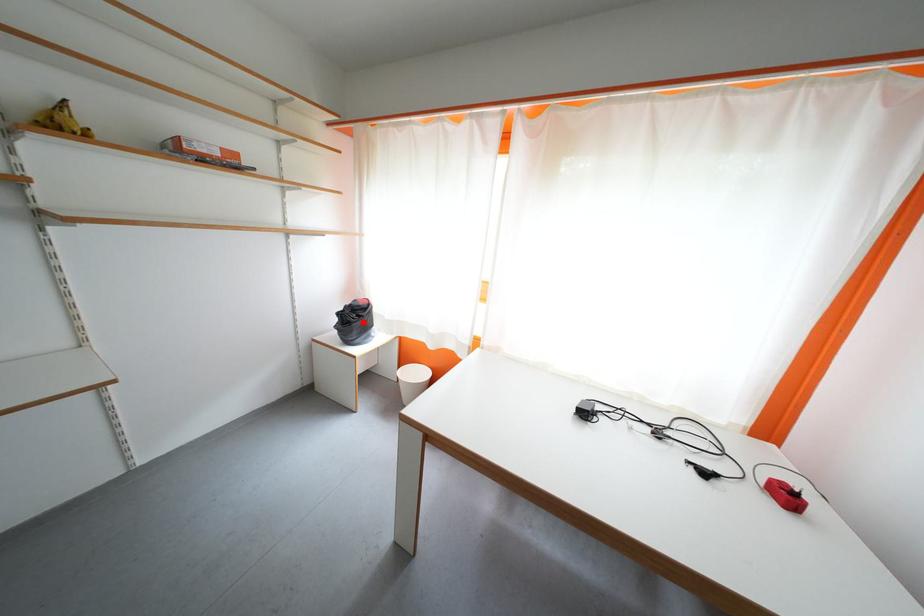
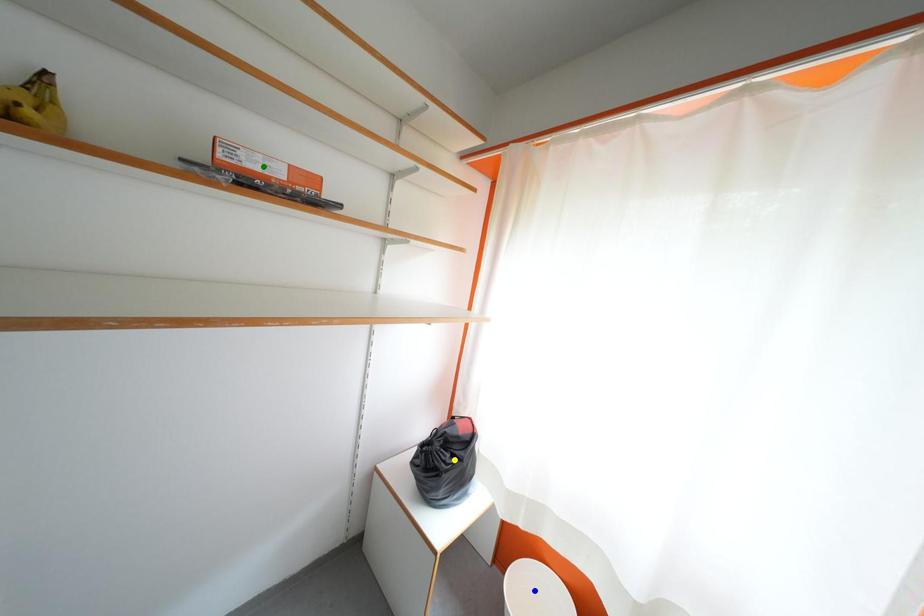
Question: I am providing you with two images of the same scene from different viewpoints. A red point is marked on the first image. You are given multiple points on the second image. In image 2, which mark is for the same physical point as the one in image 1?

Choices:
 (A) blue point
 (B) yellow point
 (C) green point

Answer: (B)